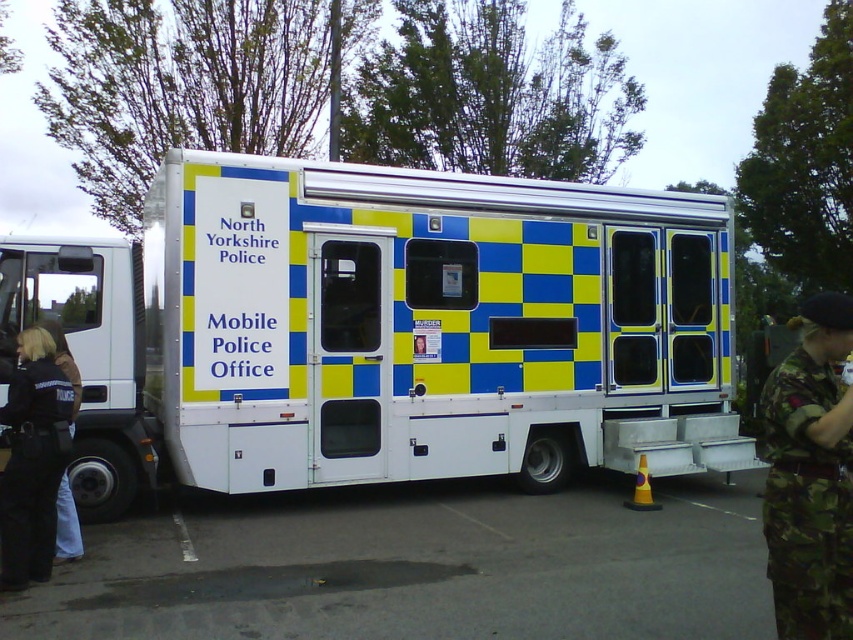
Question: Among these objects, which one is farthest from the camera?

Choices:
 (A) black uniform at lower left
 (B) camouflage fabric uniform at right
 (C) white plastic mobile police office at center
 (D) black uniform at left

Answer: (C)

Question: Can you confirm if white plastic mobile police office at center is wider than black uniform at left?

Choices:
 (A) no
 (B) yes

Answer: (B)

Question: Estimate the real-world distances between objects in this image. Which object is farther from the black uniform at lower left?

Choices:
 (A) camouflage fabric uniform at right
 (B) black uniform at left
 (C) white plastic mobile police office at center

Answer: (A)

Question: Is white plastic mobile police office at center smaller than black uniform at lower left?

Choices:
 (A) no
 (B) yes

Answer: (B)

Question: In this image, where is black uniform at lower left located relative to black uniform at left?

Choices:
 (A) right
 (B) left

Answer: (B)

Question: Which point is farther to the camera?

Choices:
 (A) black uniform at lower left
 (B) camouflage fabric uniform at right
 (C) white plastic mobile police office at center
 (D) black uniform at left

Answer: (C)